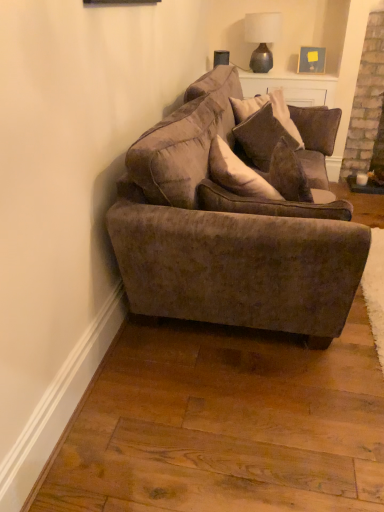
Describe the element at coordinates (236, 223) in the screenshot. The image size is (384, 512). I see `velvet brown couch at center` at that location.

Locate an element on the screen. This screenshot has height=512, width=384. velvet brown pillow at center is located at coordinates (262, 136).

Find the location of a particular element. The image size is (384, 512). matte gray glass lamp at upper center is located at coordinates (262, 38).

In the scene shown: From the image's perspective, which is above, matte gray glass lamp at upper center or velvet brown pillow at center?

matte gray glass lamp at upper center.

Is matte gray glass lamp at upper center taller than velvet brown pillow at center?

Indeed, matte gray glass lamp at upper center has a greater height compared to velvet brown pillow at center.

Locate an element on the screen. lamp above the velvet brown pillow at center (from the image's perspective) is located at coordinates (262, 38).

You are a GUI agent. You are given a task and a screenshot of the screen. Output one action in this format:
    pyautogui.click(x=<x>, y=<y>)
    Task: Click on the studio couch below the matte gray glass lamp at upper center (from the image's perspective)
    
    Given the screenshot: What is the action you would take?
    pyautogui.click(x=236, y=223)

Between velvet brown couch at center and matte gray glass lamp at upper center, which one appears on the right side from the viewer's perspective?

From the viewer's perspective, matte gray glass lamp at upper center appears more on the right side.

Is velvet brown couch at center positioned with its back to matte gray glass lamp at upper center?

velvet brown couch at center is not turned away from matte gray glass lamp at upper center.

Is the depth of velvet brown couch at center less than that of matte gray glass lamp at upper center?

Yes, velvet brown couch at center is closer to the camera.

Does velvet brown pillow at center contain velvet brown couch at center?

That's incorrect, velvet brown couch at center is not inside velvet brown pillow at center.

Considering the sizes of objects velvet brown pillow at center and velvet brown couch at center in the image provided, who is thinner, velvet brown pillow at center or velvet brown couch at center?

velvet brown pillow at center is thinner.

Is velvet brown pillow at center turned away from velvet brown couch at center?

That's right, velvet brown pillow at center is facing away from velvet brown couch at center.

Is point (278, 139) closer to camera compared to point (260, 72)?

Yes, point (278, 139) is closer to viewer.

Considering the relative sizes of velvet brown pillow at center and matte gray glass lamp at upper center in the image provided, is velvet brown pillow at center thinner than matte gray glass lamp at upper center?

Correct, the width of velvet brown pillow at center is less than that of matte gray glass lamp at upper center.

Are velvet brown pillow at center and matte gray glass lamp at upper center far apart?

Yes, velvet brown pillow at center and matte gray glass lamp at upper center are located far from each other.

Can you confirm if velvet brown pillow at center is shorter than matte gray glass lamp at upper center?

Yes.

Is velvet brown couch at center aimed at velvet brown pillow at center?

Yes, velvet brown couch at center is aimed at velvet brown pillow at center.

What's the angular difference between velvet brown couch at center and velvet brown pillow at center's facing directions?

velvet brown couch at center and velvet brown pillow at center are facing 34.3 degrees away from each other.

Where is `pillow on the right of velvet brown couch at center`? pillow on the right of velvet brown couch at center is located at coordinates (262, 136).

Between velvet brown couch at center and velvet brown pillow at center, which one has smaller width?

velvet brown pillow at center.

Looking at this image, is matte gray glass lamp at upper center turned away from velvet brown couch at center?

matte gray glass lamp at upper center does not have its back to velvet brown couch at center.

Does matte gray glass lamp at upper center have a lesser width compared to velvet brown couch at center?

Yes.

Would you say matte gray glass lamp at upper center is inside or outside velvet brown couch at center?

matte gray glass lamp at upper center is outside velvet brown couch at center.

Considering the positions of points (258, 44) and (205, 246), is point (258, 44) closer to camera compared to point (205, 246)?

That is False.

At what (x,y) coordinates should I click in order to perform the action: click on pillow on the left of matte gray glass lamp at upper center. Please return your answer as a coordinate pair (x, y). The height and width of the screenshot is (512, 384). Looking at the image, I should click on (262, 136).

I want to click on lamp above the velvet brown couch at center (from a real-world perspective), so click(262, 38).

Consider the image. Looking at the image, which one is located closer to velvet brown couch at center, velvet brown pillow at center or matte gray glass lamp at upper center?

Based on the image, velvet brown pillow at center appears to be nearer to velvet brown couch at center.

Estimate the real-world distances between objects in this image. Which object is closer to matte gray glass lamp at upper center, velvet brown pillow at center or velvet brown couch at center?

Based on the image, velvet brown pillow at center appears to be nearer to matte gray glass lamp at upper center.

When comparing their distances from velvet brown pillow at center, does velvet brown couch at center or matte gray glass lamp at upper center seem further?

matte gray glass lamp at upper center lies further to velvet brown pillow at center than the other object.

Considering their positions, is matte gray glass lamp at upper center positioned closer to velvet brown pillow at center than velvet brown couch at center?

Based on the image, velvet brown couch at center appears to be nearer to velvet brown pillow at center.

Looking at the image, which one is located further to matte gray glass lamp at upper center, velvet brown couch at center or velvet brown pillow at center?

Based on the image, velvet brown couch at center appears to be further to matte gray glass lamp at upper center.

Based on the photo, from the image, which object appears to be farther from velvet brown couch at center, matte gray glass lamp at upper center or velvet brown pillow at center?

matte gray glass lamp at upper center lies further to velvet brown couch at center than the other object.

Find the location of a particular element. This screenshot has height=512, width=384. pillow between velvet brown couch at center and matte gray glass lamp at upper center from front to back is located at coordinates pos(262,136).